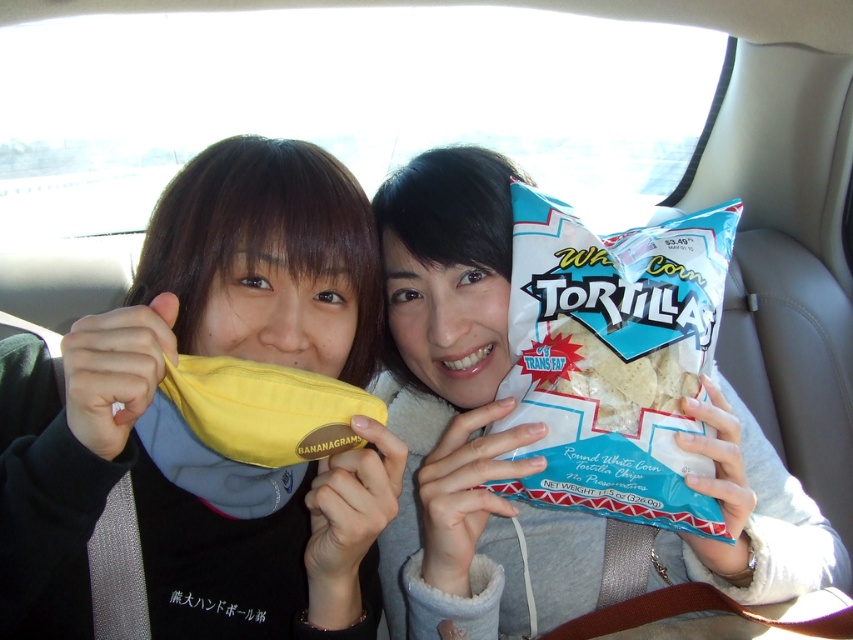
You are a delivery robot with a 24 inch wide arm. You need to reach the white paper tortilla chips at center from the front. Can your arm fit through the space between the viewer and the object?

The distance of white paper tortilla chips at center from viewer is 27.40 inches. Since the robot arm is 24 inches wide, the arm can fit through the space as it is wider than the arm.

In the scene shown: You are a delivery person who needs to place a 12 inch long package between the yellow fabric bag at center and the white corn tortilla at center. Can you fit it there?

The yellow fabric bag at center and white corn tortilla at center are 10.19 inches apart. Since the package is 12 inches long, it cannot fit between them as the distance is shorter than the package length.

You are a passenger in a car and you want to place both the yellow fabric bag at center and the white corn tortilla at center on the car seat. Which object should you place first to ensure there is enough space for both?

You should place the white corn tortilla at center first because it is taller than the yellow fabric bag at center, so placing the taller item first ensures there is enough space for both.